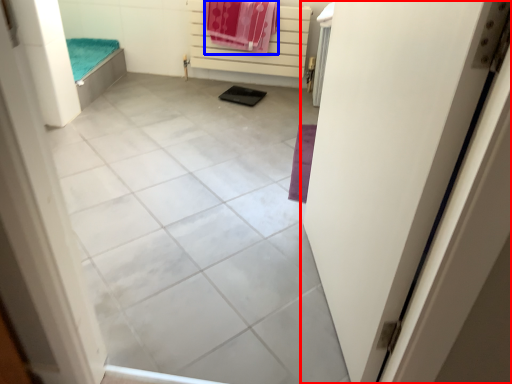
Question: Which object appears farthest to the camera in this image, door (highlighted by a red box) or beach towel (highlighted by a blue box)?

Choices:
 (A) door
 (B) beach towel

Answer: (B)